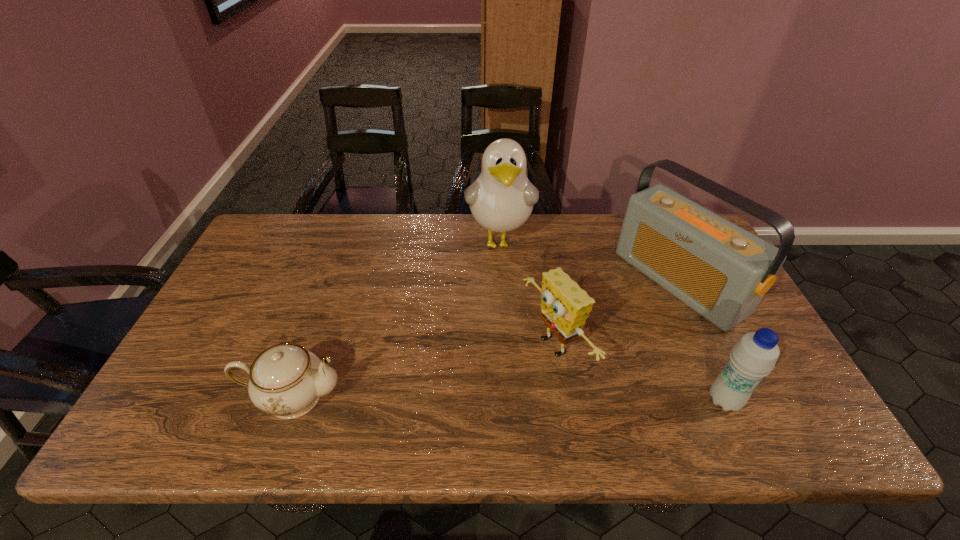
Find the location of a particular element. The image size is (960, 540). the leftmost object is located at coordinates (286, 380).

I want to click on the shortest object, so click(286, 380).

This screenshot has height=540, width=960. In order to click on water bottle in this screenshot , I will do `click(754, 356)`.

Where is `radio receiver`? radio receiver is located at coordinates (720, 270).

At what (x,y) coordinates should I click in order to perform the action: click on sponge. Please return your answer as a coordinate pair (x, y). Image resolution: width=960 pixels, height=540 pixels. Looking at the image, I should click on (565, 306).

Image resolution: width=960 pixels, height=540 pixels. What are the coordinates of `gull` in the screenshot? It's located at (501, 199).

I want to click on vacant space located 0.370m at the spout of the shortest object, so click(x=504, y=397).

You are a GUI agent. You are given a task and a screenshot of the screen. Output one action in this format:
    pyautogui.click(x=<x>, y=<y>)
    Task: Click on the free space located on the back of the water bottle
    
    Given the screenshot: What is the action you would take?
    pyautogui.click(x=667, y=274)

I want to click on free space located on the front-facing side of the radio receiver, so click(559, 360).

At what (x,y) coordinates should I click in order to perform the action: click on free space located 0.080m on the front-facing side of the radio receiver. Please return your answer as a coordinate pair (x, y). Looking at the image, I should click on (623, 321).